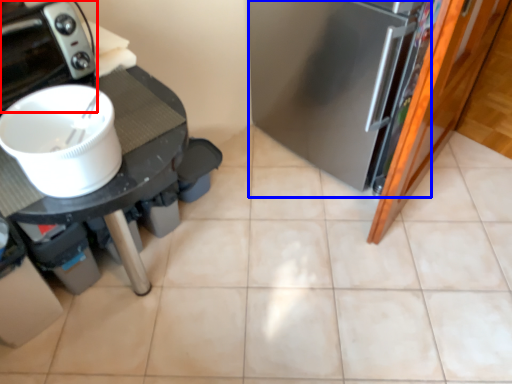
Question: Which point is closer to the camera, home appliance (highlighted by a red box) or fridge (highlighted by a blue box)?

Choices:
 (A) home appliance
 (B) fridge

Answer: (A)